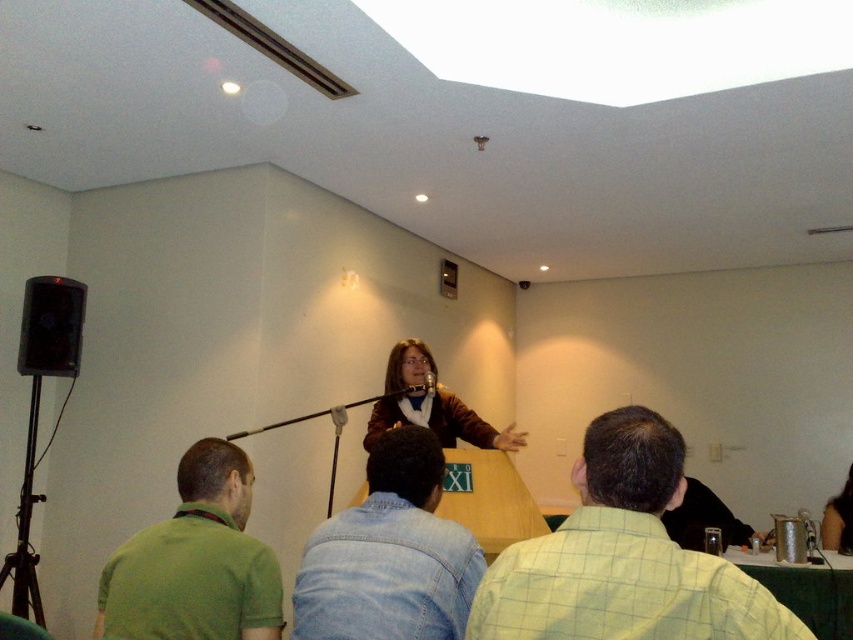
Image resolution: width=853 pixels, height=640 pixels. Describe the element at coordinates (389, 554) in the screenshot. I see `denim jacket at lower center` at that location.

Does denim jacket at lower center have a lesser height compared to smooth black hair at upper right?

A: No.

Which is in front, point (320, 572) or point (843, 497)?

Point (320, 572) is in front.

The width and height of the screenshot is (853, 640). I want to click on denim jacket at lower center, so click(389, 554).

Does denim jacket at lower center appear over brown leather jacket at center?

Indeed, denim jacket at lower center is positioned over brown leather jacket at center.

Find the location of a particular element. This screenshot has width=853, height=640. denim jacket at lower center is located at coordinates (389, 554).

Which is in front, point (198, 579) or point (431, 371)?

Point (198, 579) is more forward.

Is green matte shirt at lower left to the left of metallic silver microphone at center from the viewer's perspective?

Yes, green matte shirt at lower left is to the left of metallic silver microphone at center.

This screenshot has height=640, width=853. Find the location of `green matte shirt at lower left`. green matte shirt at lower left is located at coordinates (195, 561).

Identify the location of green matte shirt at lower left. The image size is (853, 640). (195, 561).